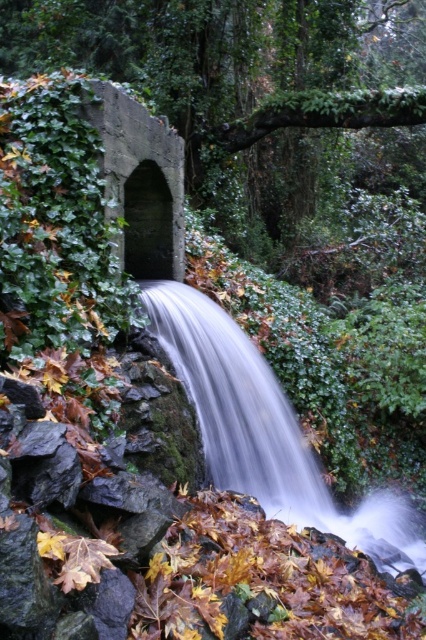
You are standing at the base of the waterfall and want to take a photo. The camera you are using has a limited focus range. You notice two points in the scene labeled as point (117, 26) and point (198, 376). Which point should you focus on to ensure both points are in focus?

You should focus on point (117, 26) because it is closer to the camera than point (198, 376). By focusing on the closer point, the depth of field will extend further, potentially keeping both points in focus.